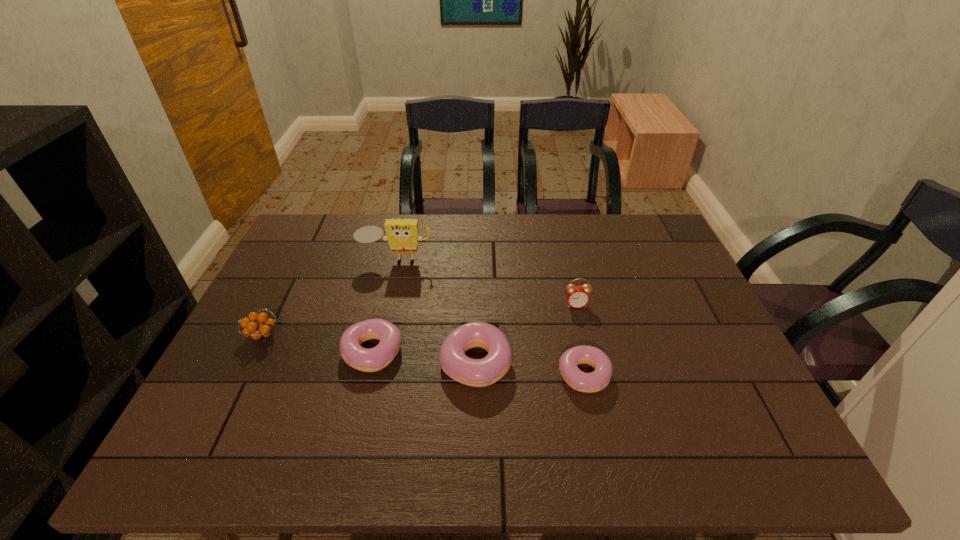
The image size is (960, 540). I want to click on unoccupied area between the sponge and the shortest object, so click(x=490, y=318).

Where is `vacant area that lies between the leftmost object and the second tallest object`? This screenshot has width=960, height=540. vacant area that lies between the leftmost object and the second tallest object is located at coordinates (420, 320).

Locate which object is the third closest to the sponge. Please provide its 2D coordinates. Your answer should be formatted as a tuple, i.e. [(x, y)], where the tuple contains the x and y coordinates of a point satisfying the conditions above.

[(483, 372)]

Identify the location of object that ranks as the fifth closest to the fifth nearest object. click(260, 330).

Identify which doughnut is the nearest to the alarm clock. Please provide its 2D coordinates. Your answer should be formatted as a tuple, i.e. [(x, y)], where the tuple contains the x and y coordinates of a point satisfying the conditions above.

[(597, 380)]

Where is `doughnut that is the second closest to the leftmost doughnut`? The height and width of the screenshot is (540, 960). doughnut that is the second closest to the leftmost doughnut is located at coordinates (597, 380).

You are a GUI agent. You are given a task and a screenshot of the screen. Output one action in this format:
    pyautogui.click(x=<x>, y=<y>)
    Task: Click on the free spot that satisfies the following two spatial constraints: 1. on the front-facing side of the sponge; 2. on the left side of the shortest object
    The width and height of the screenshot is (960, 540).
    Given the screenshot: What is the action you would take?
    pos(370,374)

Find the location of `free spot that satisfies the following two spatial constraints: 1. on the front side of the shortest doughnut; 2. on the left side of the orange fruit`. free spot that satisfies the following two spatial constraints: 1. on the front side of the shortest doughnut; 2. on the left side of the orange fruit is located at coordinates (244, 374).